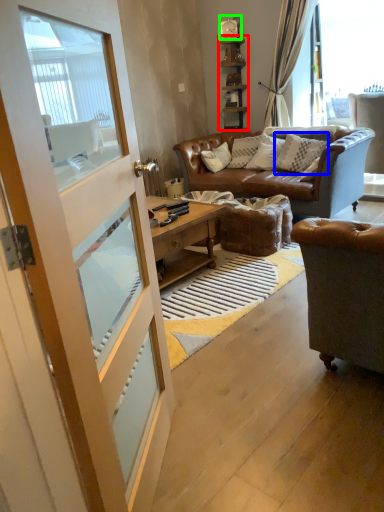
Question: Which is farther away from shelf (highlighted by a red box)? pillow (highlighted by a blue box) or clock (highlighted by a green box)?

Choices:
 (A) pillow
 (B) clock

Answer: (A)